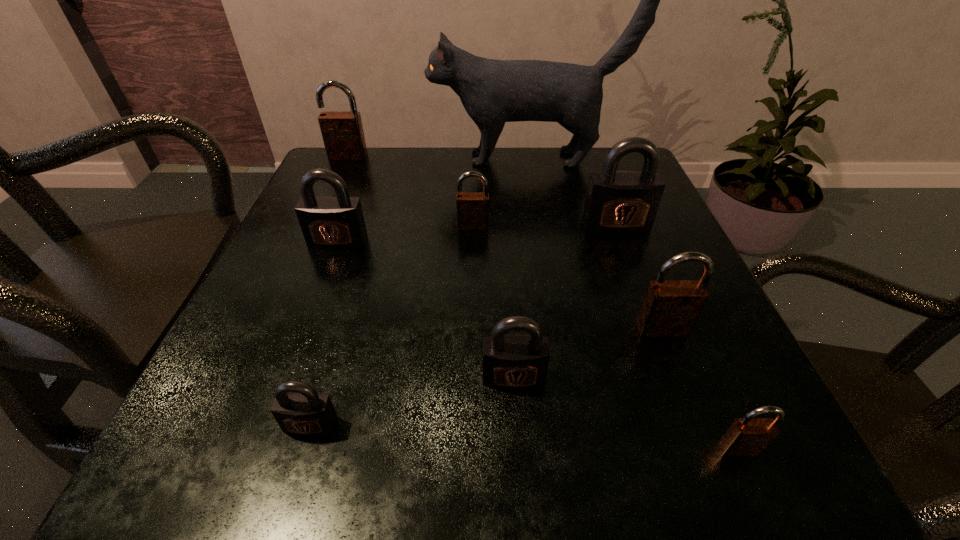
What are the coordinates of `gray cat` in the screenshot? It's located at (493, 92).

Where is `cat`? cat is located at coordinates (493, 92).

Find the location of a particular element. The width and height of the screenshot is (960, 540). the biggest gray padlock is located at coordinates (619, 202).

Find the location of a particular element. The height and width of the screenshot is (540, 960). the farthest brown padlock is located at coordinates coord(342,131).

At what (x,y) coordinates should I click in order to perform the action: click on the leftmost brown padlock. Please return your answer as a coordinate pair (x, y). Looking at the image, I should click on point(342,131).

Locate an element on the screen. The height and width of the screenshot is (540, 960). the second biggest gray padlock is located at coordinates (337, 222).

You are a GUI agent. You are given a task and a screenshot of the screen. Output one action in this format:
    pyautogui.click(x=<x>, y=<y>)
    Task: Click on the second biggest brown padlock
    
    Given the screenshot: What is the action you would take?
    pyautogui.click(x=670, y=308)

Locate an element on the screen. The height and width of the screenshot is (540, 960). the fifth farthest padlock is located at coordinates (670, 308).

Identify the location of the second brown padlock from left to right. (472, 207).

Locate an element on the screen. The image size is (960, 540). the second farthest brown padlock is located at coordinates (472, 207).